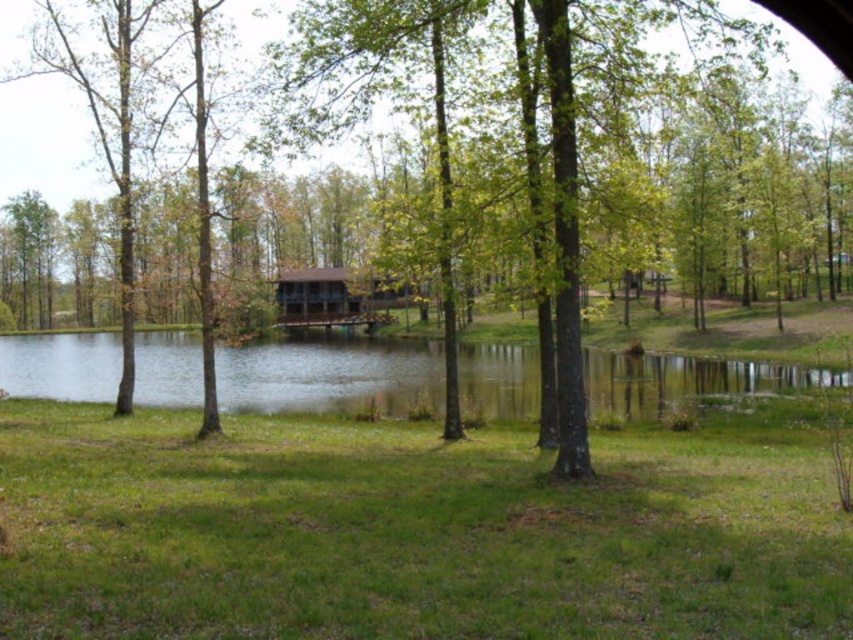
Question: Is clear water at center to the left of brown wooden cabin at center from the viewer's perspective?

Choices:
 (A) yes
 (B) no

Answer: (A)

Question: Which point is closer to the camera taking this photo?

Choices:
 (A) (340, 301)
 (B) (802, 384)

Answer: (B)

Question: Which of the following is the farthest from the observer?

Choices:
 (A) brown wooden cabin at center
 (B) clear water at center

Answer: (B)

Question: In this image, where is clear water at center located relative to brown wooden cabin at center?

Choices:
 (A) left
 (B) right

Answer: (A)

Question: Which point appears farthest from the camera in this image?

Choices:
 (A) (299, 308)
 (B) (320, 365)

Answer: (A)

Question: Is clear water at center to the right of brown wooden cabin at center from the viewer's perspective?

Choices:
 (A) no
 (B) yes

Answer: (A)